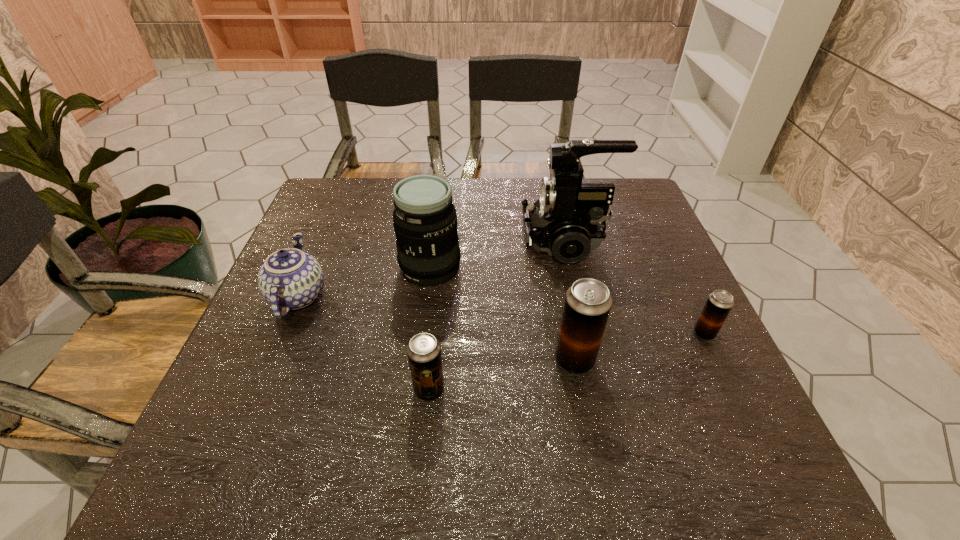
At what (x,y) coordinates should I click in order to perform the action: click on free space located 0.250m on the right of the second beer can from left to right. Please return your answer as a coordinate pair (x, y). This screenshot has height=540, width=960. Looking at the image, I should click on (x=720, y=360).

This screenshot has height=540, width=960. In order to click on vacant space situated on the left of the shortest beer can in this screenshot , I will do `click(550, 333)`.

Where is `vacant region located 0.120m on the lens mount of the camcorder`? This screenshot has height=540, width=960. vacant region located 0.120m on the lens mount of the camcorder is located at coordinates (477, 240).

I want to click on vacant space situated 0.150m on the lens mount of the camcorder, so click(466, 240).

Image resolution: width=960 pixels, height=540 pixels. What are the coordinates of `vacant space positioned 0.270m on the lens mount of the camcorder` in the screenshot? It's located at (420, 240).

I want to click on vacant point located on the front of the telephoto lens, so click(x=424, y=318).

Find the location of a particular element. This screenshot has height=540, width=960. free region located 0.180m at the spout of the leftmost object is located at coordinates (407, 296).

At what (x,y) coordinates should I click in order to perform the action: click on object present at the far edge. Please return your answer as a coordinate pair (x, y). Image resolution: width=960 pixels, height=540 pixels. Looking at the image, I should click on (567, 221).

The image size is (960, 540). What are the coordinates of `object that is at the near edge` in the screenshot? It's located at (424, 351).

Locate an element on the screen. This screenshot has width=960, height=540. object situated at the left edge is located at coordinates (291, 279).